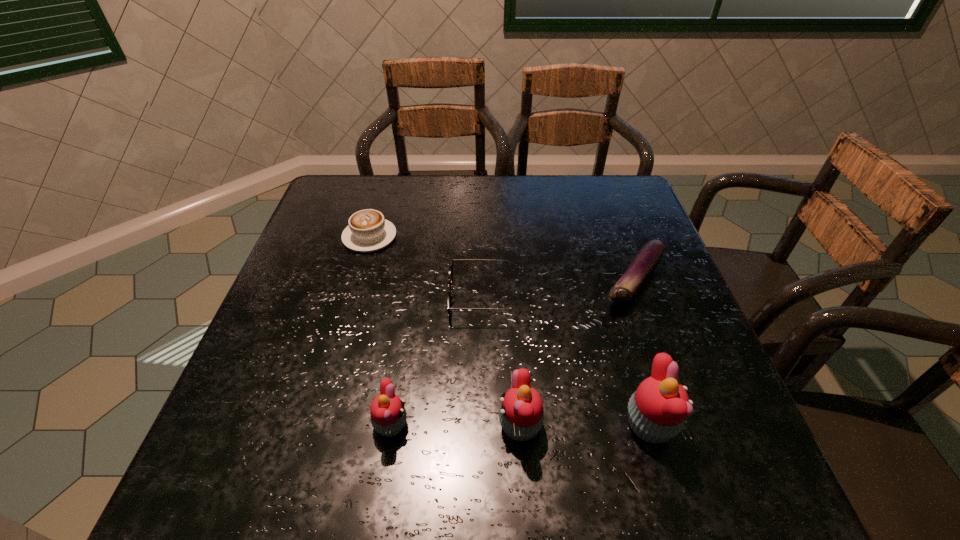
Identify the location of vacant space positioned on the face of the second shortest cupcake. The image size is (960, 540). (322, 426).

Locate an element on the screen. Image resolution: width=960 pixels, height=540 pixels. vacant space situated 0.340m on the face of the second shortest cupcake is located at coordinates (310, 426).

Locate an element on the screen. The height and width of the screenshot is (540, 960). free space located on the face of the second shortest cupcake is located at coordinates (420, 426).

Find the location of `free space located 0.080m on the face of the tallest object`. free space located 0.080m on the face of the tallest object is located at coordinates (720, 426).

I want to click on free point located 0.150m with the handle on the right side of the cappuccino, so click(x=383, y=191).

At what (x,y) coordinates should I click in order to perform the action: click on free space located with the handle on the right side of the cappuccino. Please return your answer as a coordinate pair (x, y). This screenshot has width=960, height=540. Looking at the image, I should click on (377, 208).

You are a GUI agent. You are given a task and a screenshot of the screen. Output one action in this format:
    pyautogui.click(x=<x>, y=<y>)
    Task: Click on the vacant space situated with the handle on the right side of the cappuccino
    The image size is (960, 540).
    Given the screenshot: What is the action you would take?
    pyautogui.click(x=384, y=187)

What are the coordinates of `free spot located 0.150m on the front of the eggplant` in the screenshot? It's located at (664, 370).

Locate an element on the screen. The image size is (960, 540). vacant space situated 0.380m through the lenses of the spectacles is located at coordinates (285, 298).

Locate an element on the screen. This screenshot has width=960, height=540. vacant space situated through the lenses of the spectacles is located at coordinates (346, 298).